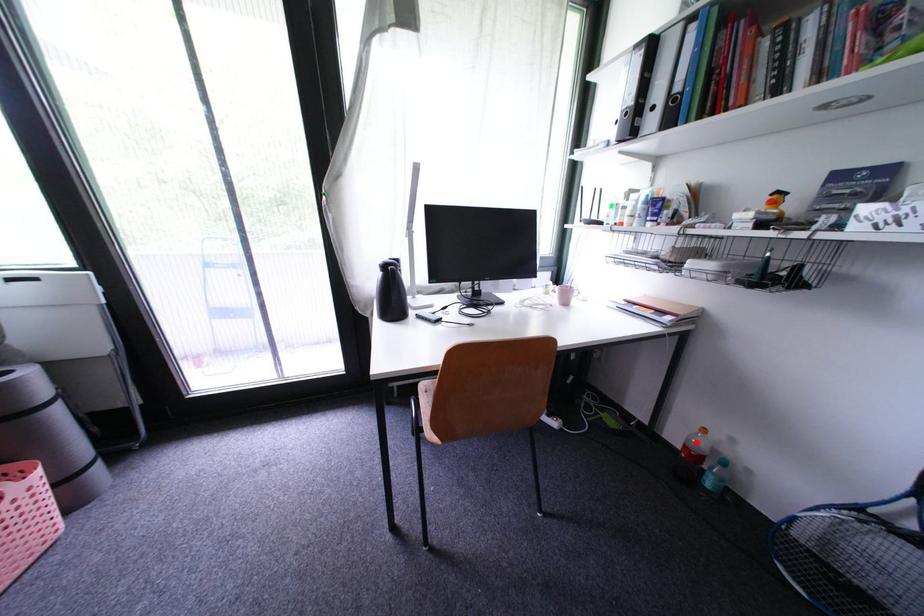
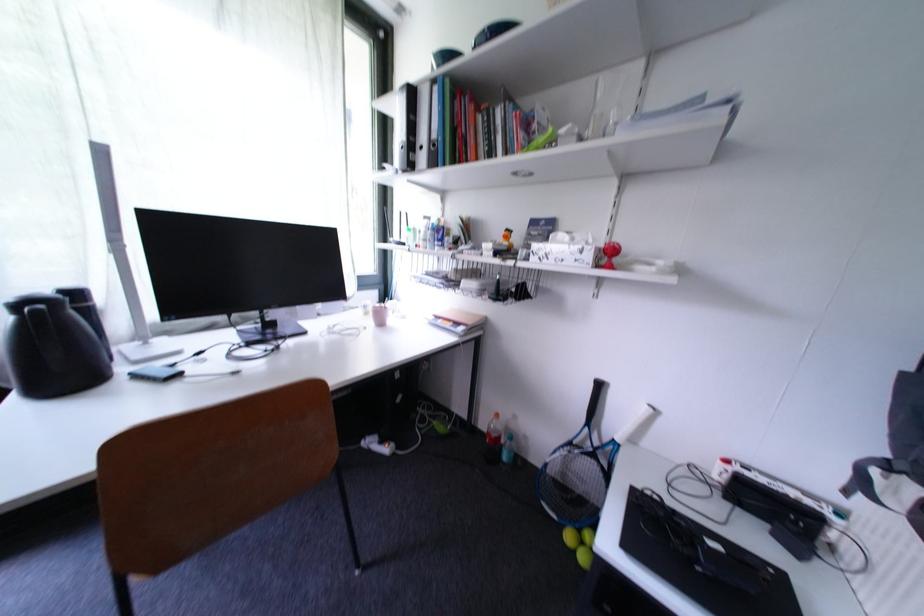
Question: I am providing you with two images of the same scene from different viewpoints. Given a red point in image1, look at the same physical point in image2. Is it:

Choices:
 (A) Closer to the viewpoint
 (B) Farther from the viewpoint

Answer: (B)